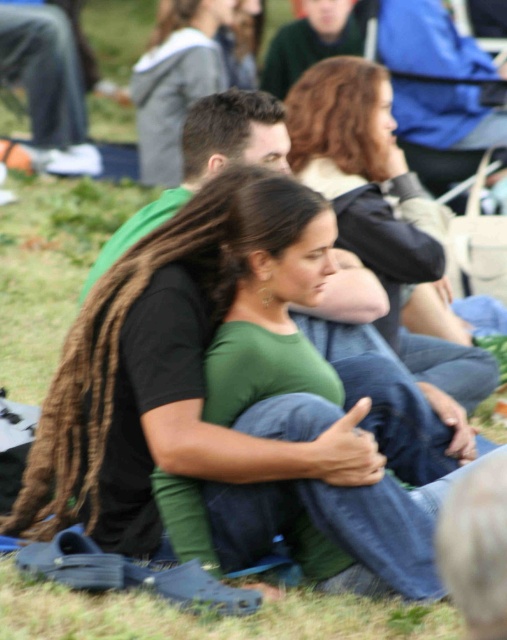
Is green grass at lower center to the right of black matte shirt at center from the viewer's perspective?

No, green grass at lower center is not to the right of black matte shirt at center.

Is green grass at lower center thinner than black matte shirt at center?

In fact, green grass at lower center might be wider than black matte shirt at center.

The width and height of the screenshot is (507, 640). What are the coordinates of `green grass at lower center` in the screenshot? It's located at (208, 616).

Is green grass at lower center bigger than green fabric pants at lower left?

No.

Locate an element on the screen. This screenshot has width=507, height=640. green grass at lower center is located at coordinates (208, 616).

Identify the location of green grass at lower center. (208, 616).

Which is in front, point (363, 321) or point (172, 52)?

Point (363, 321) is more forward.

Does black matte shirt at center lie behind green matte shirt at center?

No, black matte shirt at center is closer to the viewer.

Who is more forward, (x=156, y=225) or (x=209, y=67)?

Point (x=156, y=225) is more forward.

The height and width of the screenshot is (640, 507). What are the coordinates of `black matte shirt at center` in the screenshot? It's located at (207, 160).